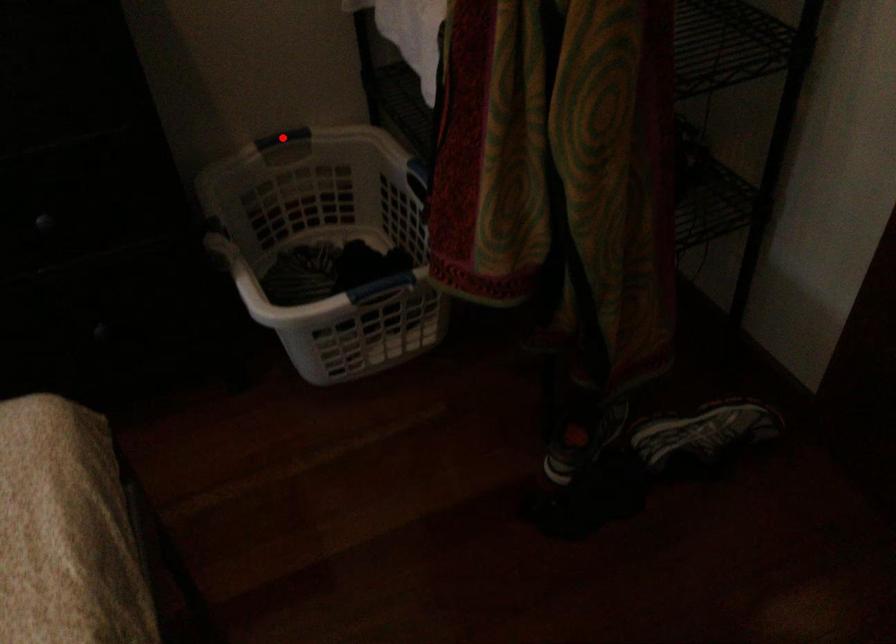
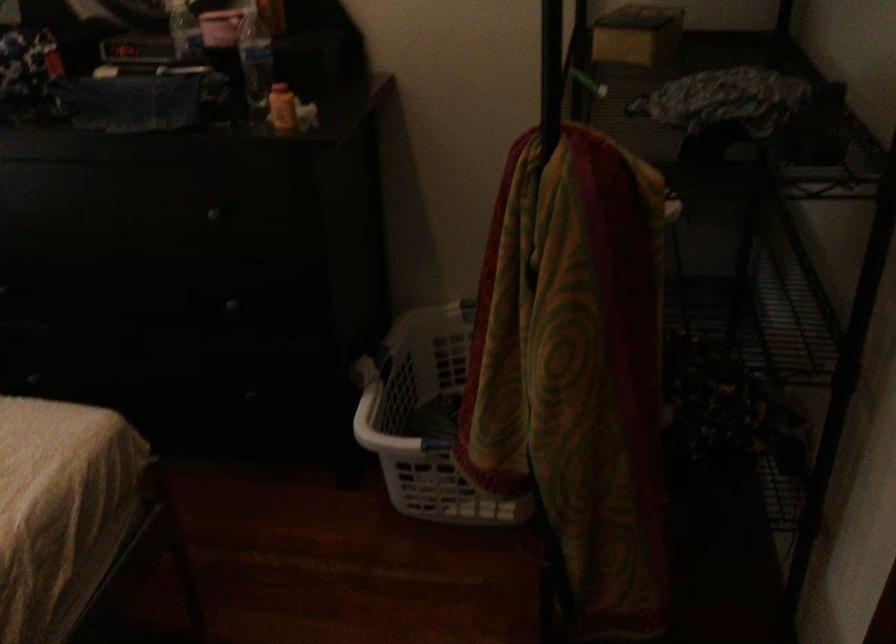
Question: I am providing you with two images of the same scene from different viewpoints. A red point is marked on the first image. At the location where the point appears in image 1, is it still visible in image 2?

Choices:
 (A) Yes
 (B) No

Answer: (B)